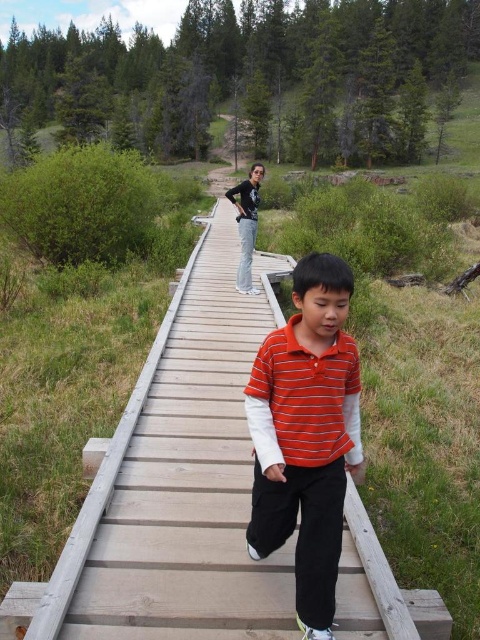
You are planning to cross the wooden bridge at center while wearing the black cotton pants at center. Considering the bridge width, will you have enough space to walk comfortably?

The wooden bridge at center is wider than the black cotton pants at center, so you will have enough space to walk comfortably.

You are a photographer trying to capture the orange striped shirt at center and the wooden bridge at center in the same frame. Given that your camera has a fixed focal length, which object should you position closer to the camera to ensure both fit within the frame?

Since the wooden bridge at center is wider than the orange striped shirt at center, you should position the wooden bridge at center closer to the camera. This way, its larger size will be reduced in the frame, allowing both objects to fit within the camera view.

You are standing at the point marked by the coordinates point (x=175, y=483). What object is located at this position?

The point (x=175, y=483) marks the wooden bridge at center.